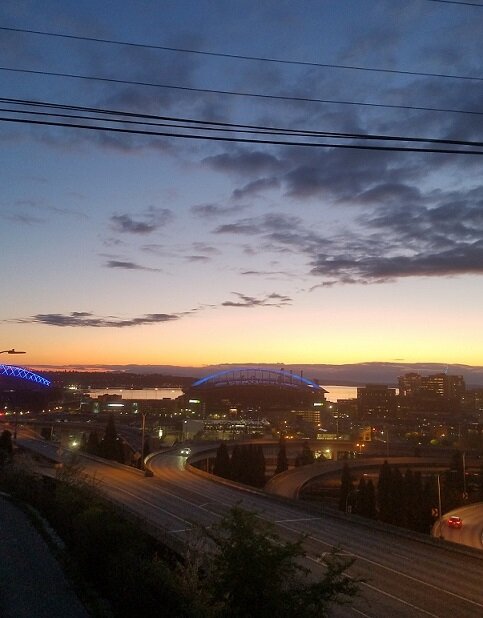
In order to click on light in this screenshot , I will do `click(59, 345)`.